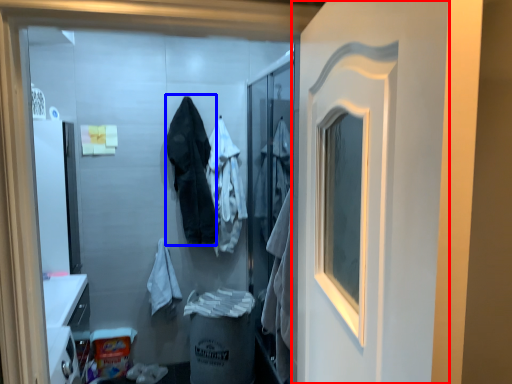
Question: Which of the following is the farthest to the observer, door (highlighted by a red box) or clothing (highlighted by a blue box)?

Choices:
 (A) door
 (B) clothing

Answer: (B)